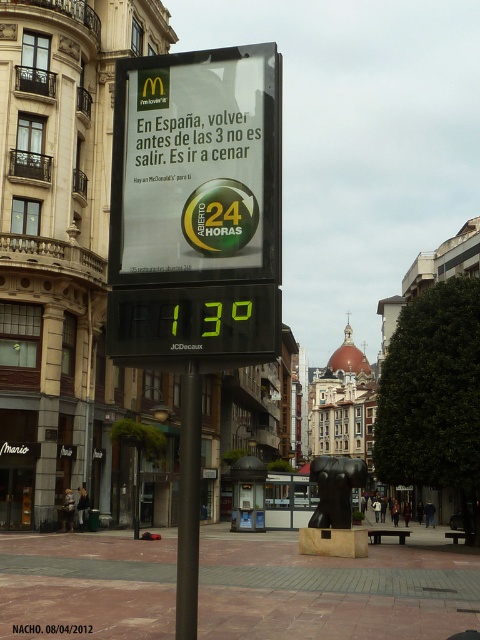
Question: Can you confirm if white paper sign at center is wider than black metal pole at center?

Choices:
 (A) yes
 (B) no

Answer: (A)

Question: In this image, where is white paper sign at center located relative to black metal pole at center?

Choices:
 (A) right
 (B) left

Answer: (B)

Question: Does white paper sign at center lie in front of black metal pole at center?

Choices:
 (A) no
 (B) yes

Answer: (A)